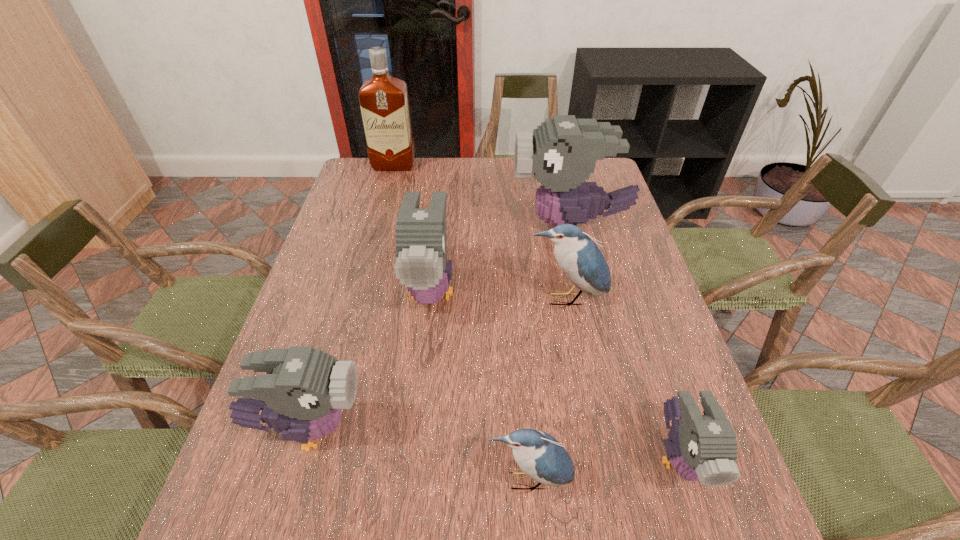
This screenshot has width=960, height=540. I want to click on liquor, so click(383, 99).

Image resolution: width=960 pixels, height=540 pixels. Find the location of `the farthest object`. the farthest object is located at coordinates (383, 99).

Find the location of a particular element. The height and width of the screenshot is (540, 960). the farthest gray bird is located at coordinates (562, 152).

I want to click on the sixth shortest object, so coord(562,152).

Identify the location of the second biggest gray bird. coord(421,240).

This screenshot has width=960, height=540. In order to click on the second bird from left to right in this screenshot , I will do coord(421,240).

Image resolution: width=960 pixels, height=540 pixels. Find the location of `the bigger blue bird`. the bigger blue bird is located at coordinates (580, 259).

Identify the location of the third biggest gray bird. (302, 395).

The width and height of the screenshot is (960, 540). I want to click on the leftmost gray bird, so click(x=302, y=395).

Find the location of a particular element. The height and width of the screenshot is (540, 960). the nearer blue bird is located at coordinates (539, 455).